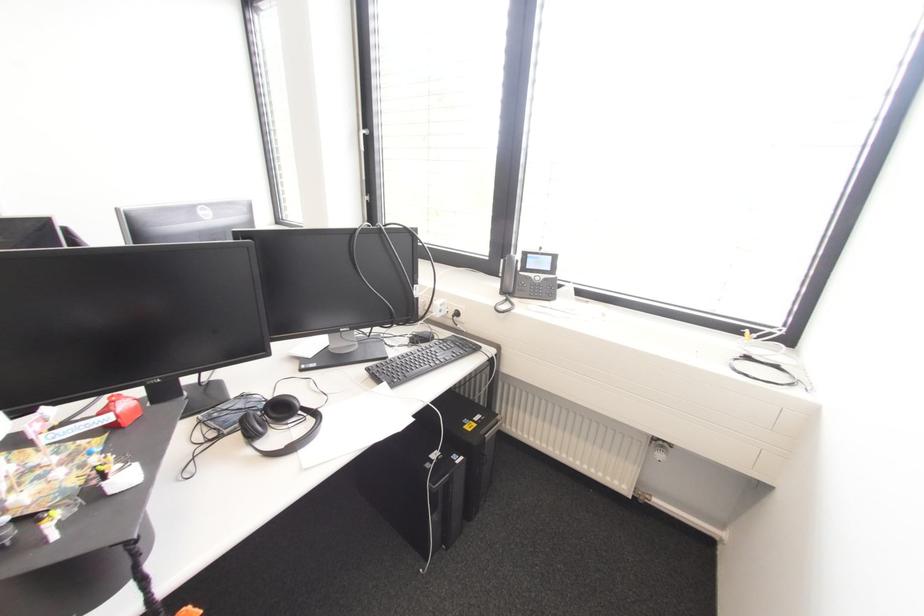
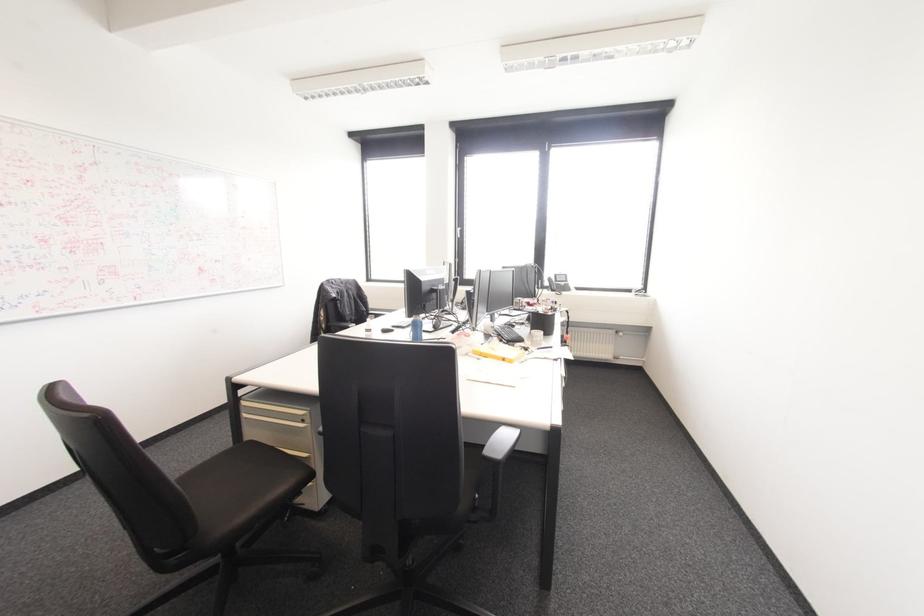
What movement of the cameraman would produce the second image?

→ The movement direction of the cameraman is left, backward.